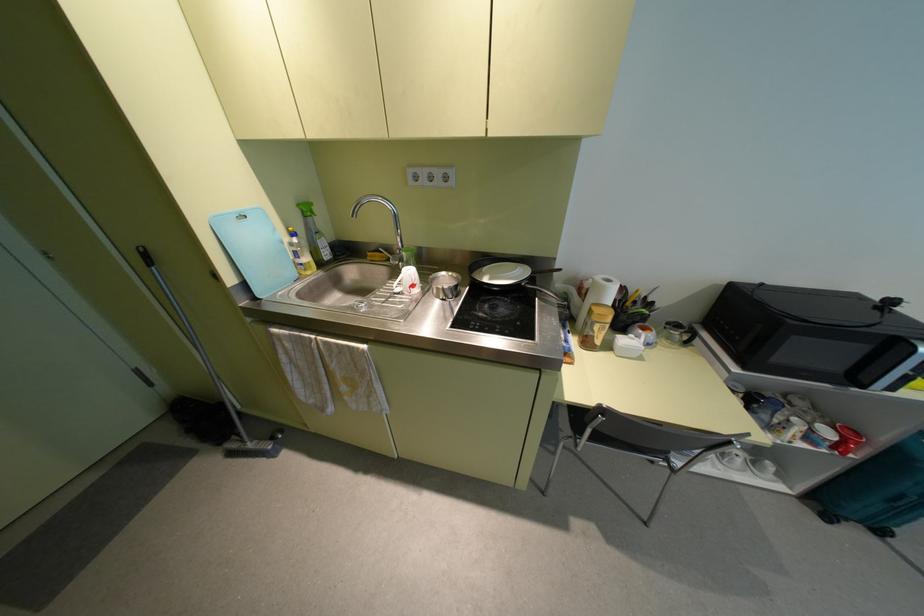
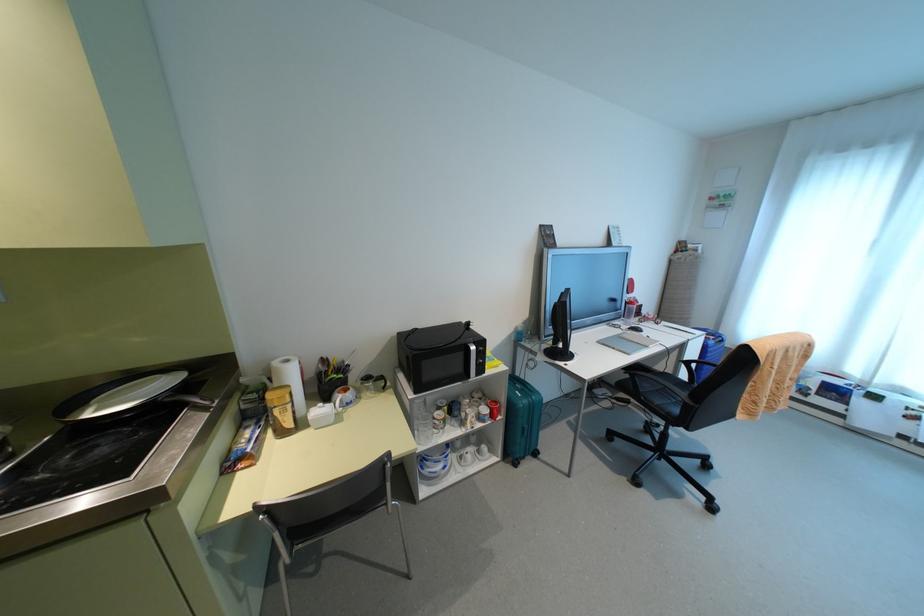
The point at [608,280] is marked in the first image. Where is the corresponding point in the second image?

(286, 361)